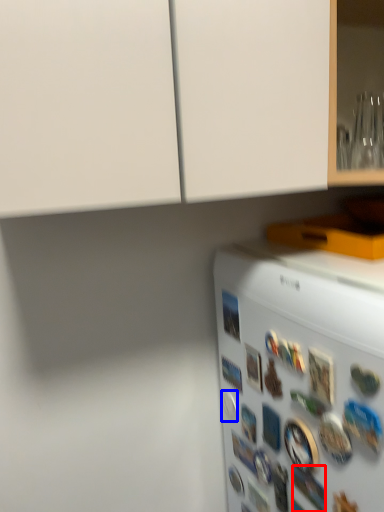
Question: Which object appears closest to the camera in this image, button (highlighted by a red box) or button (highlighted by a blue box)?

Choices:
 (A) button
 (B) button

Answer: (A)